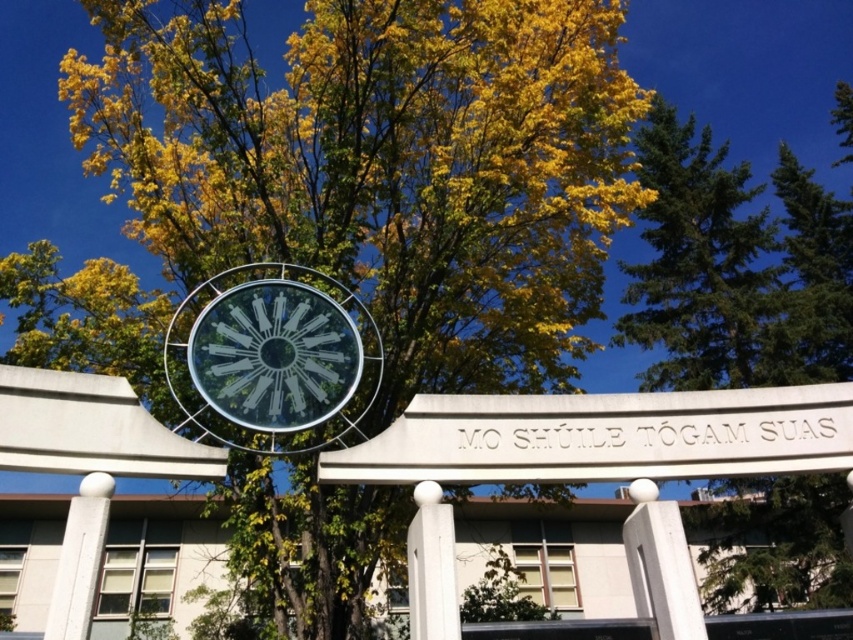
You are standing in front of the large circular structure and notice the transparent glass clock at center and the white glossy pillar at center. Which object is positioned to the left?

The transparent glass clock at center is to the left of the white glossy pillar at center.

You are standing in front of the large circular metallic structure. You notice a point marked at coordinates (x=735, y=268). Can you identify what object is located at this point?

The point at coordinates (x=735, y=268) marks a green leafy tree at upper right.